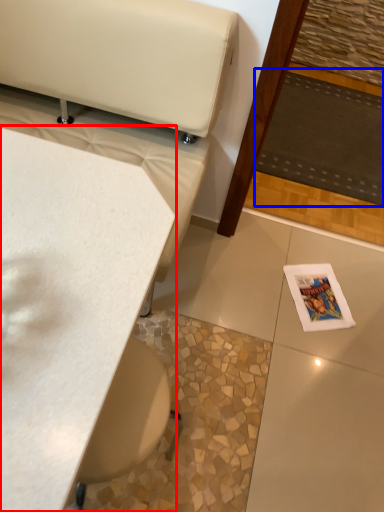
Question: Among these objects, which one is farthest to the camera, table (highlighted by a red box) or mat (highlighted by a blue box)?

Choices:
 (A) table
 (B) mat

Answer: (B)